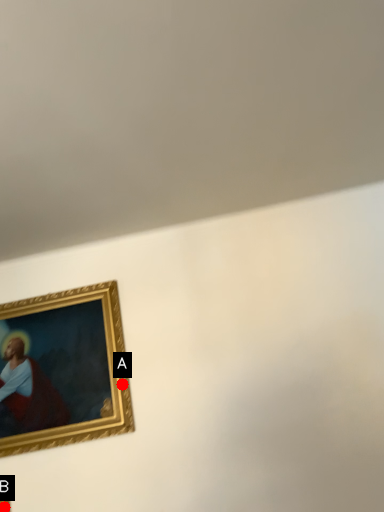
Question: Two points are circled on the image, labeled by A and B beside each circle. Which point is closer to the camera?

Choices:
 (A) A is closer
 (B) B is closer

Answer: (B)